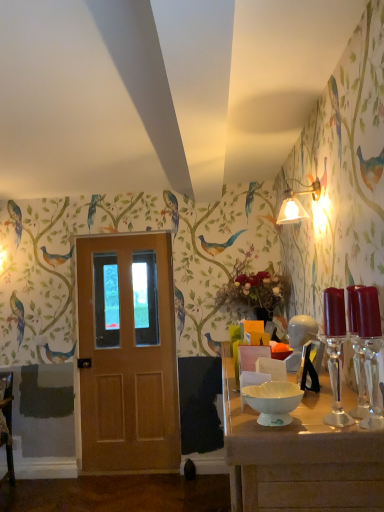
Question: Is white glossy table at lower right inside or outside of wooden door at center?

Choices:
 (A) inside
 (B) outside

Answer: (B)

Question: Is point (309, 484) positioned closer to the camera than point (157, 249)?

Choices:
 (A) closer
 (B) farther

Answer: (A)

Question: Which object is positioned farthest from the wooden door at center?

Choices:
 (A) white glossy table at lower right
 (B) matte white lampshade at upper right
 (C) white glossy bowl at center

Answer: (C)

Question: Based on their relative distances, which object is farther from the white glossy bowl at center?

Choices:
 (A) matte white lampshade at upper right
 (B) wooden door at center
 (C) white glossy table at lower right

Answer: (B)